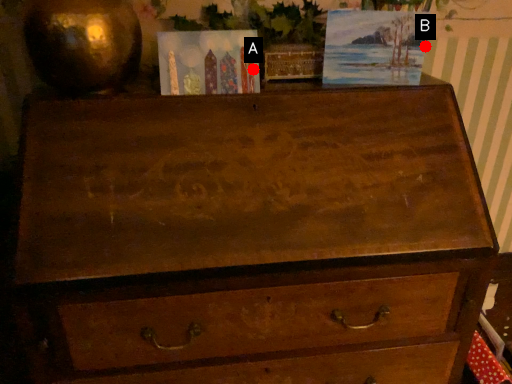
Question: Two points are circled on the image, labeled by A and B beside each circle. Among these points, which one is nearest to the camera?

Choices:
 (A) A is closer
 (B) B is closer

Answer: (A)